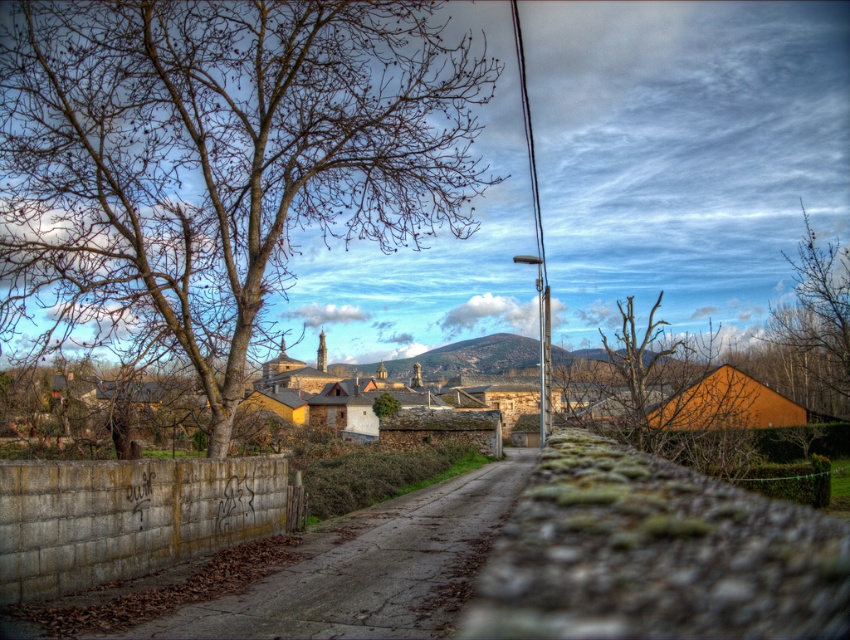
Does bare wood tree at left appear on the right side of bare branches at right?

In fact, bare wood tree at left is to the left of bare branches at right.

Who is more distant from viewer, (128,100) or (840,339)?

Positioned behind is point (840,339).

Where is `bare wood tree at left`? The height and width of the screenshot is (640, 850). bare wood tree at left is located at coordinates (221, 157).

Does point (380, 1) lie in front of point (756, 461)?

Yes, it is in front of point (756, 461).

Can you confirm if bare wood tree at left is thinner than bare branches at center?

Yes.

Who is more distant from viewer, (85, 138) or (642, 436)?

Positioned behind is point (642, 436).

Where is `bare wood tree at left`? bare wood tree at left is located at coordinates (x=221, y=157).

Who is shorter, bare branches at center or bare branches at right?

With less height is bare branches at center.

Is bare branches at center to the left of bare branches at right from the viewer's perspective?

Indeed, bare branches at center is positioned on the left side of bare branches at right.

Which is in front, point (728, 442) or point (837, 264)?

Point (728, 442) is more forward.

In order to click on bare branches at center in this screenshot , I will do `click(673, 404)`.